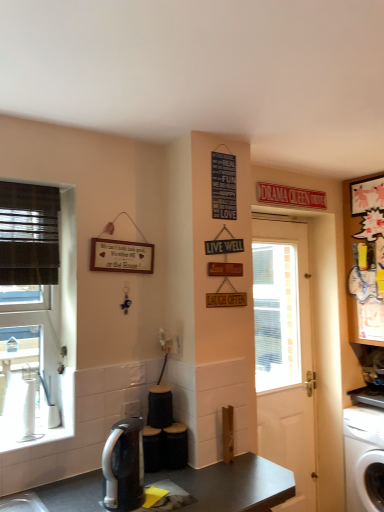
Question: Does dark gray laminate desk at center have a lesser width compared to sleek silver coffee maker at lower center?

Choices:
 (A) no
 (B) yes

Answer: (A)

Question: Does dark gray laminate desk at center have a lesser height compared to sleek silver coffee maker at lower center?

Choices:
 (A) no
 (B) yes

Answer: (A)

Question: From the image's perspective, is dark gray laminate desk at center located beneath sleek silver coffee maker at lower center?

Choices:
 (A) yes
 (B) no

Answer: (A)

Question: Can we say dark gray laminate desk at center lies outside sleek silver coffee maker at lower center?

Choices:
 (A) yes
 (B) no

Answer: (A)

Question: From the image's perspective, is dark gray laminate desk at center over sleek silver coffee maker at lower center?

Choices:
 (A) yes
 (B) no

Answer: (B)

Question: Considering the positions of dark gray laminate desk at center and sleek silver coffee maker at lower center in the image, is dark gray laminate desk at center wider or thinner than sleek silver coffee maker at lower center?

Choices:
 (A) wide
 (B) thin

Answer: (A)

Question: Is point (41, 495) closer or farther from the camera than point (142, 500)?

Choices:
 (A) closer
 (B) farther

Answer: (B)

Question: Considering the relative positions of dark gray laminate desk at center and sleek silver coffee maker at lower center in the image provided, is dark gray laminate desk at center to the left or to the right of sleek silver coffee maker at lower center?

Choices:
 (A) right
 (B) left

Answer: (A)

Question: Is dark gray laminate desk at center inside the boundaries of sleek silver coffee maker at lower center, or outside?

Choices:
 (A) outside
 (B) inside

Answer: (A)

Question: From the image's perspective, relative to cartoon paper cutout at upper right, is white plastic washing machine at lower right above or below?

Choices:
 (A) above
 (B) below

Answer: (B)

Question: In terms of height, does white plastic washing machine at lower right look taller or shorter compared to cartoon paper cutout at upper right?

Choices:
 (A) short
 (B) tall

Answer: (A)

Question: Visually, is white plastic washing machine at lower right positioned to the left or to the right of cartoon paper cutout at upper right?

Choices:
 (A) right
 (B) left

Answer: (B)

Question: Is white plastic washing machine at lower right bigger or smaller than cartoon paper cutout at upper right?

Choices:
 (A) small
 (B) big

Answer: (A)

Question: From the image's perspective, is dark gray laminate desk at center positioned above or below white matte door at center?

Choices:
 (A) below
 (B) above

Answer: (A)

Question: Do you think dark gray laminate desk at center is within white matte door at center, or outside of it?

Choices:
 (A) inside
 (B) outside

Answer: (B)